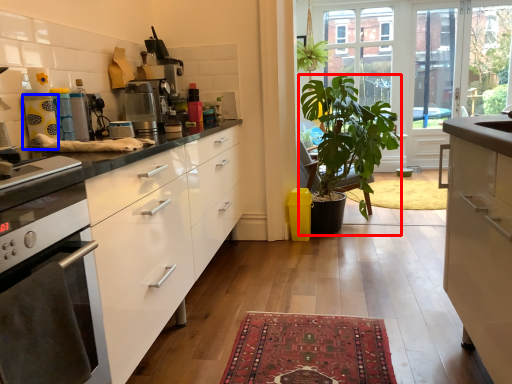
Question: Among these objects, which one is nearest to the camera, houseplant (highlighted by a red box) or appliance (highlighted by a blue box)?

Choices:
 (A) houseplant
 (B) appliance

Answer: (B)